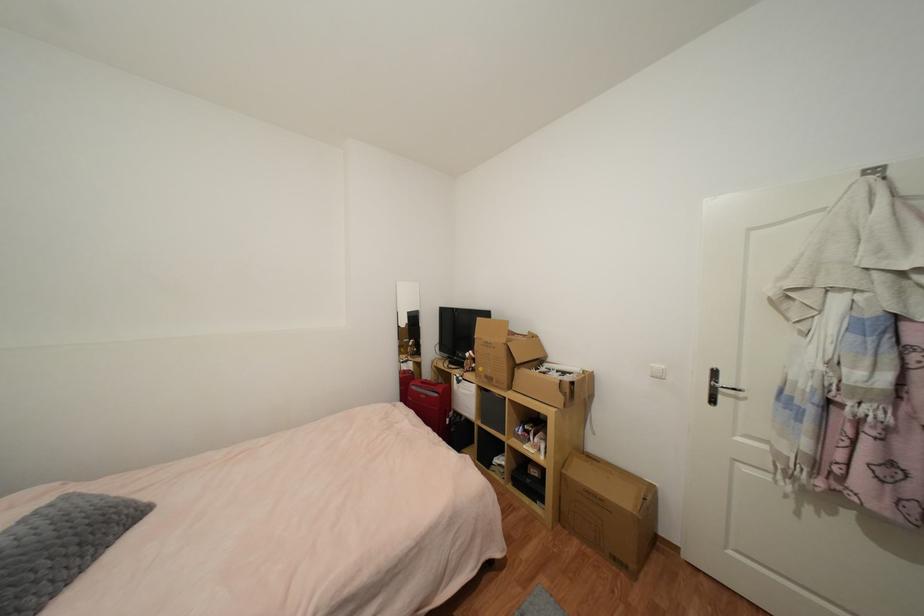
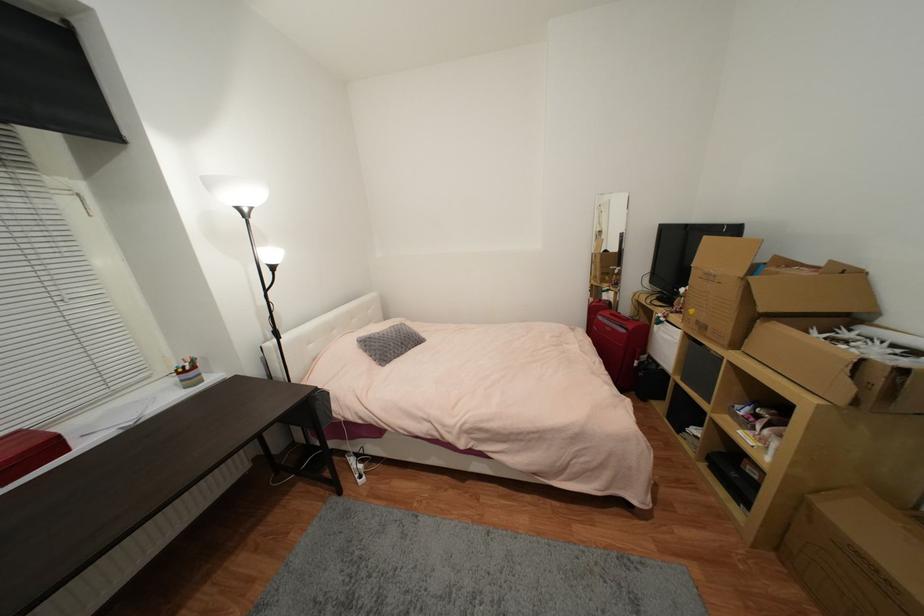
The point at [564,517] is marked in the first image. Where is the corresponding point in the second image?

(782, 546)